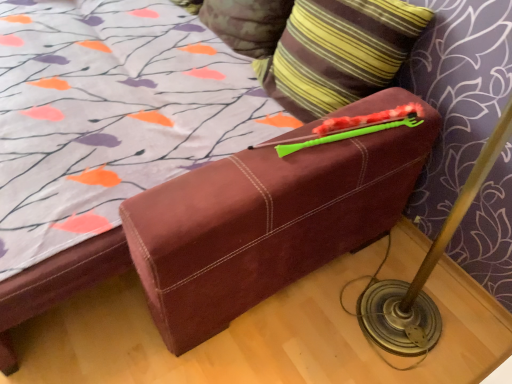
Question: In terms of height, does striped fabric pillow at upper center, placed as the 1th pillow when sorted from back to front, look taller or shorter compared to striped fabric pillow at upper right, marked as the 2th pillow in a back-to-front arrangement?

Choices:
 (A) short
 (B) tall

Answer: (A)

Question: Looking at their shapes, would you say striped fabric pillow at upper center, the second pillow when ordered from front to back, is wider or thinner than striped fabric pillow at upper right, marked as the 2th pillow in a back-to-front arrangement?

Choices:
 (A) thin
 (B) wide

Answer: (A)

Question: Based on their positions, is striped fabric pillow at upper center, placed as the 1th pillow when sorted from back to front, located to the left or right of striped fabric pillow at upper right, marked as the 2th pillow in a back-to-front arrangement?

Choices:
 (A) left
 (B) right

Answer: (A)

Question: Does point (377, 86) appear closer or farther from the camera than point (284, 9)?

Choices:
 (A) closer
 (B) farther

Answer: (A)

Question: From a real-world perspective, is striped fabric pillow at upper right, marked as the 2th pillow in a back-to-front arrangement, physically located above or below striped fabric pillow at upper center, placed as the 1th pillow when sorted from back to front?

Choices:
 (A) above
 (B) below

Answer: (A)

Question: Would you say striped fabric pillow at upper right, marked as the 2th pillow in a back-to-front arrangement, is to the left or to the right of striped fabric pillow at upper center, the second pillow when ordered from front to back, in the picture?

Choices:
 (A) right
 (B) left

Answer: (A)

Question: In terms of height, does striped fabric pillow at upper right, arranged as the 1th pillow when viewed from the front, look taller or shorter compared to striped fabric pillow at upper center, the second pillow when ordered from front to back?

Choices:
 (A) short
 (B) tall

Answer: (B)